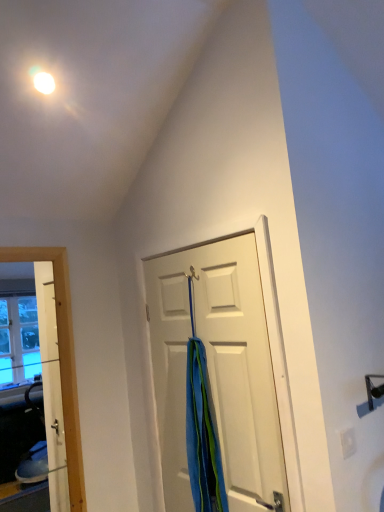
At what (x,y) coordinates should I click in order to perform the action: click on blue fabric shower curtain at center. Please return your answer as a coordinate pair (x, y). This screenshot has width=384, height=512. Looking at the image, I should click on (201, 429).

The image size is (384, 512). What do you see at coordinates (201, 429) in the screenshot? I see `blue fabric shower curtain at center` at bounding box center [201, 429].

The image size is (384, 512). I want to click on white matte door at center, so click(x=217, y=370).

What do you see at coordinates (217, 370) in the screenshot?
I see `white matte door at center` at bounding box center [217, 370].

The width and height of the screenshot is (384, 512). What are the coordinates of `blue fabric shower curtain at center` in the screenshot? It's located at (201, 429).

Is white matte door at center to the right of blue fabric shower curtain at center from the viewer's perspective?

Yes, white matte door at center is to the right of blue fabric shower curtain at center.

Which is behind, white matte door at center or blue fabric shower curtain at center?

blue fabric shower curtain at center.

Which is closer, (213, 377) or (204, 416)?

Point (213, 377).

In the scene shown: From the image's perspective, which one is positioned higher, white matte door at center or blue fabric shower curtain at center?

white matte door at center appears higher in the image.

From a real-world perspective, which object stands above the other?

white matte door at center is physically above.

Is white matte door at center wider than blue fabric shower curtain at center?

No.

Is white matte door at center shorter than blue fabric shower curtain at center?

No.

Can you confirm if white matte door at center is smaller than blue fabric shower curtain at center?

No.

Is white matte door at center spatially inside blue fabric shower curtain at center, or outside of it?

white matte door at center is not enclosed by blue fabric shower curtain at center.

Is white matte door at center touching blue fabric shower curtain at center?

There is a gap between white matte door at center and blue fabric shower curtain at center.

Is white matte door at center facing towards blue fabric shower curtain at center?

Yes, white matte door at center is aimed at blue fabric shower curtain at center.

What's the angular difference between white matte door at center and blue fabric shower curtain at center's facing directions?

white matte door at center and blue fabric shower curtain at center are facing 0.00115 degrees away from each other.

Where is `shower curtain that appears below the white matte door at center (from a real-world perspective)`? Image resolution: width=384 pixels, height=512 pixels. shower curtain that appears below the white matte door at center (from a real-world perspective) is located at coordinates (201, 429).

Based on their positions, is blue fabric shower curtain at center located to the left or right of white matte door at center?

Clearly, blue fabric shower curtain at center is on the left of white matte door at center in the image.

Is blue fabric shower curtain at center further to the viewer compared to white matte door at center?

Yes, it is.

Is point (189, 347) positioned in front of point (274, 403)?

No.

From the image's perspective, is blue fabric shower curtain at center located beneath white matte door at center?

Indeed, from the image's perspective, blue fabric shower curtain at center is shown beneath white matte door at center.

From a real-world perspective, is blue fabric shower curtain at center positioned above or below white matte door at center?

In terms of real-world spatial position, blue fabric shower curtain at center is below white matte door at center.

Consider the image. Can you confirm if blue fabric shower curtain at center is thinner than white matte door at center?

Incorrect, the width of blue fabric shower curtain at center is not less than that of white matte door at center.

Considering the sizes of blue fabric shower curtain at center and white matte door at center in the image, is blue fabric shower curtain at center taller or shorter than white matte door at center?

Clearly, blue fabric shower curtain at center is shorter compared to white matte door at center.

Which of these two, blue fabric shower curtain at center or white matte door at center, is smaller?

With smaller size is blue fabric shower curtain at center.

Is blue fabric shower curtain at center outside of white matte door at center?

blue fabric shower curtain at center lies outside white matte door at center's area.

Is blue fabric shower curtain at center beside white matte door at center?

No, blue fabric shower curtain at center is not in contact with white matte door at center.

Is blue fabric shower curtain at center oriented away from white matte door at center?

Absolutely, blue fabric shower curtain at center is directed away from white matte door at center.

How different are the orientations of blue fabric shower curtain at center and white matte door at center in degrees?

They differ by 0.00115 degrees in their facing directions.

Image resolution: width=384 pixels, height=512 pixels. Identify the location of door above the blue fabric shower curtain at center (from the image's perspective). (217, 370).

What are the coordinates of `shower curtain below the white matte door at center (from a real-world perspective)` in the screenshot? It's located at (201, 429).

Locate an element on the screen. shower curtain that appears behind the white matte door at center is located at coordinates (201, 429).